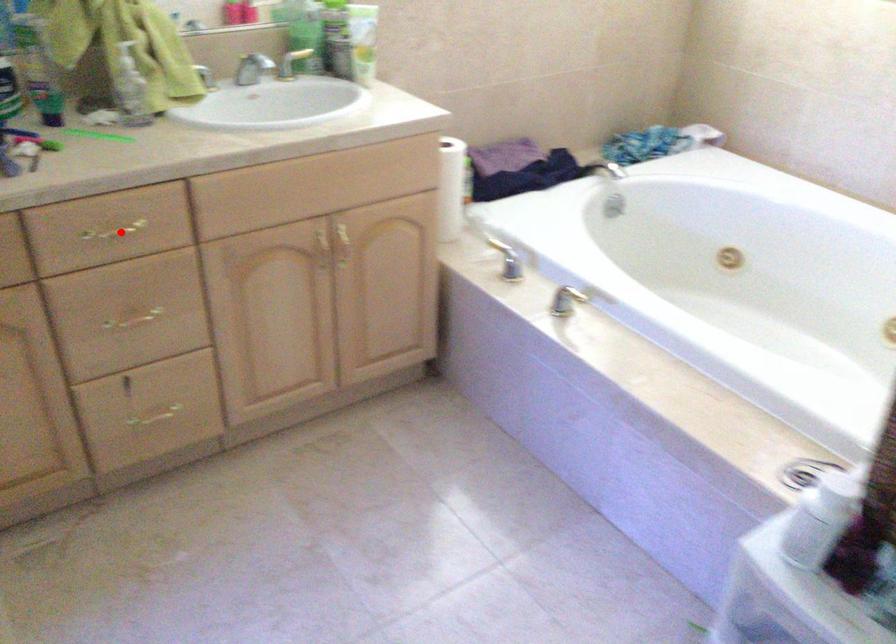
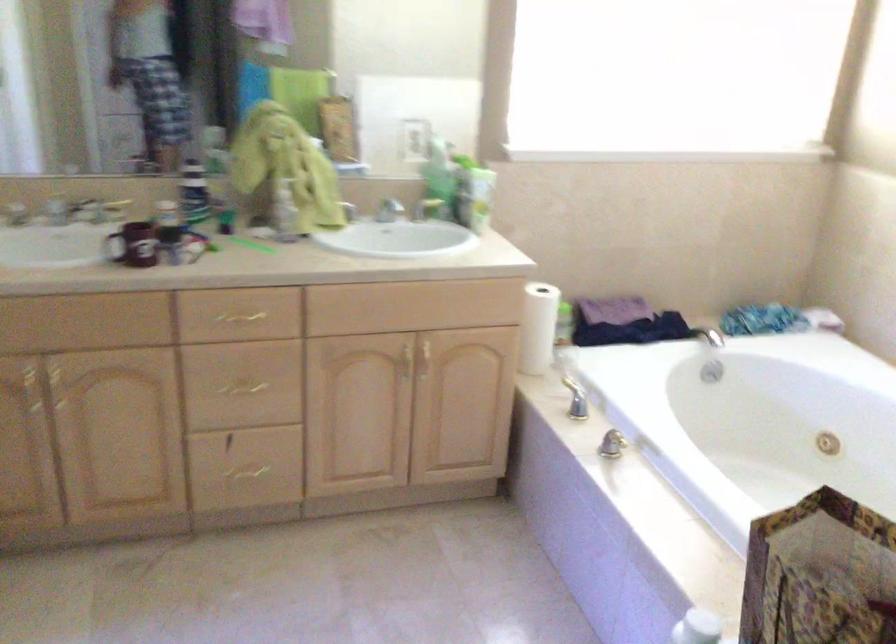
In the second image, find the point that corresponds to the highlighted location in the first image.

(244, 317)